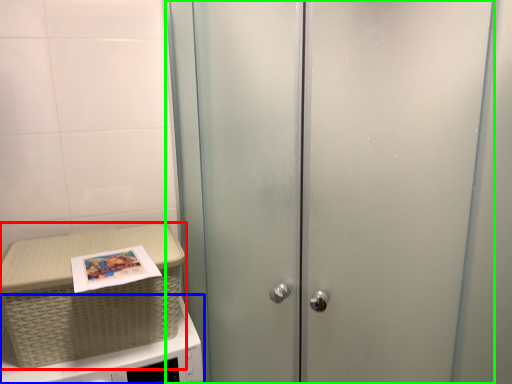
Question: Considering the real-world distances, which object is closest to picnic basket (highlighted by a red box)? microwave oven (highlighted by a blue box) or door (highlighted by a green box).

Choices:
 (A) microwave oven
 (B) door

Answer: (A)